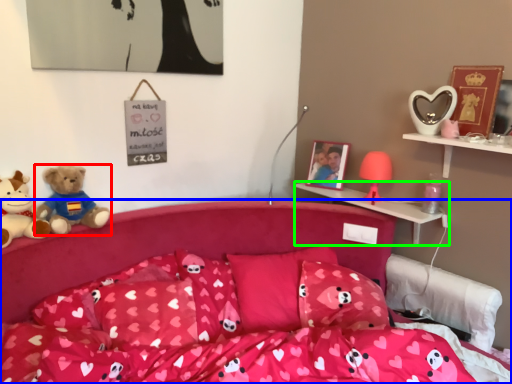
Question: Which object is positioned farthest from teddy bear (highlighted by a red box)? Select from bed (highlighted by a blue box) and shelf (highlighted by a green box).

Choices:
 (A) bed
 (B) shelf

Answer: (B)